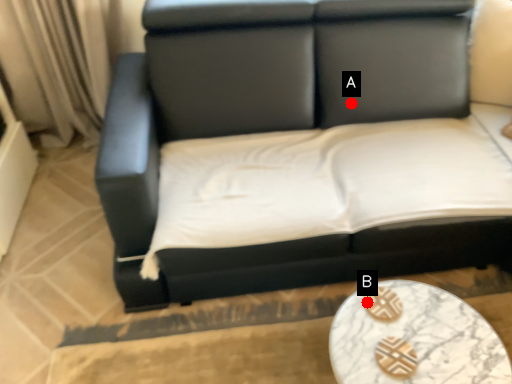
Question: Two points are circled on the image, labeled by A and B beside each circle. Among these points, which one is farthest from the camera?

Choices:
 (A) A is further
 (B) B is further

Answer: (A)